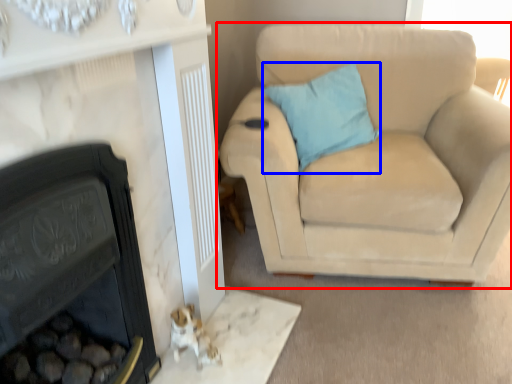
Question: Among these objects, which one is nearest to the camera, studio couch (highlighted by a red box) or pillow (highlighted by a blue box)?

Choices:
 (A) studio couch
 (B) pillow

Answer: (A)